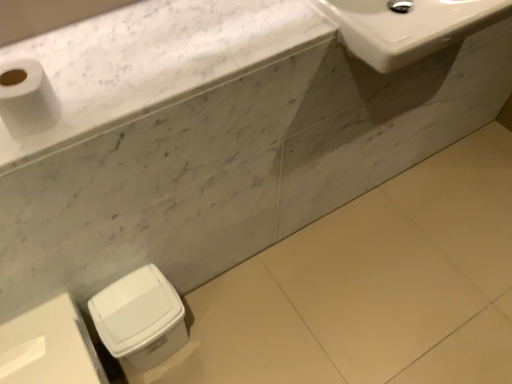
Question: Is white plastic trash can at lower left, the 2th porcelain from the right, situated inside white marble countertop at upper left or outside?

Choices:
 (A) inside
 (B) outside

Answer: (B)

Question: Is white plastic trash can at lower left, the first porcelain viewed from the left, taller or shorter than white marble countertop at upper left?

Choices:
 (A) short
 (B) tall

Answer: (B)

Question: Which of these objects is positioned farthest from the white matte toilet paper at upper left?

Choices:
 (A) white glossy sink at upper right
 (B) white plastic trash can at lower left, marked as the second porcelain in a left-to-right arrangement
 (C) white plastic trash can at lower left, the 2th porcelain from the right
 (D) white marble countertop at upper left

Answer: (A)

Question: Which object is positioned farthest from the white plastic trash can at lower left, the first porcelain viewed from the left?

Choices:
 (A) white marble countertop at upper left
 (B) white glossy sink at upper right
 (C) white matte toilet paper at upper left
 (D) white plastic trash can at lower left, marked as the second porcelain in a left-to-right arrangement

Answer: (B)